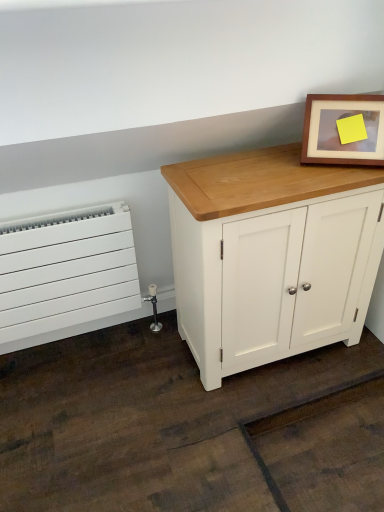
Locate an element on the screen. vacant space in front of white painted wood cabinet at center is located at coordinates (239, 426).